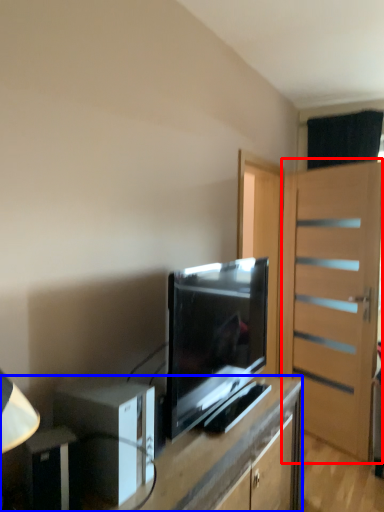
Question: Which point is closer to the camera, door (highlighted by a red box) or desk (highlighted by a blue box)?

Choices:
 (A) door
 (B) desk

Answer: (B)